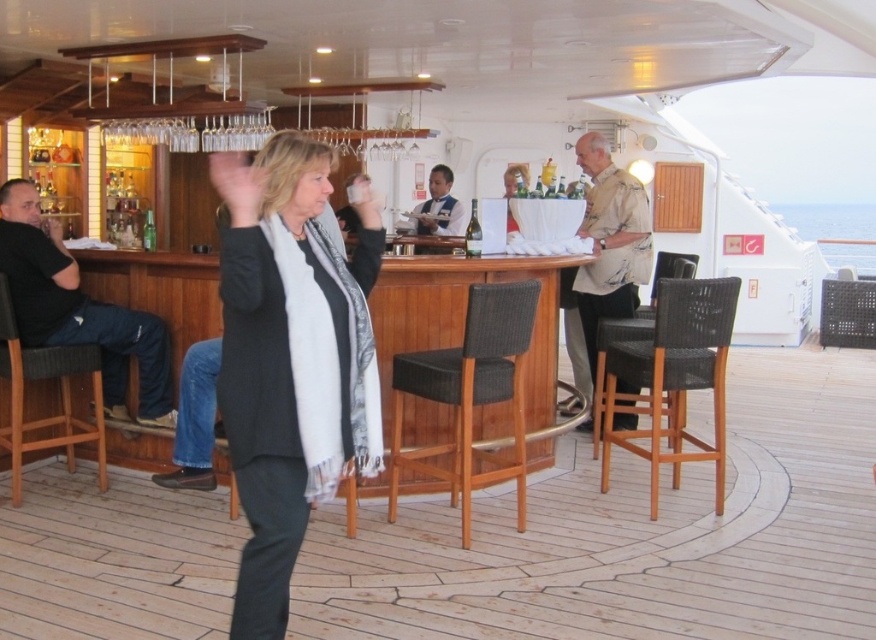
You are a guest at the cruise ship bar. You want to sit on the black woven bar stool at center but need to pass by the black cotton shirt at left. Is the path clear to sit down?

The black woven bar stool at center is below the black cotton shirt at left, meaning the shirt is above the stool. Since the shirt is above, there is enough vertical clearance to sit down without obstruction.

You are standing at the entrance of the cruise ship bar and see the wooden deck at center and the black woven bar stool at center. Which object is positioned to the right of the other?

The wooden deck at center is to the right of the black woven bar stool at center.

You are standing at the back of the cruise ship bar and want to grab a drink. There is a black woven bar stool at center and a black cotton shirt at left. Which object is closer to you?

The black woven bar stool at center is closer to the viewer than the black cotton shirt at left.